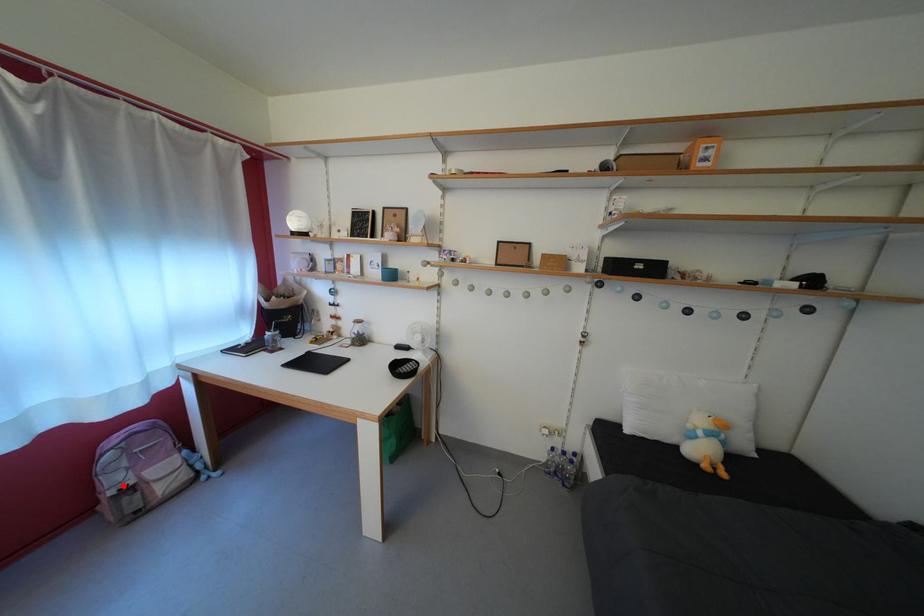
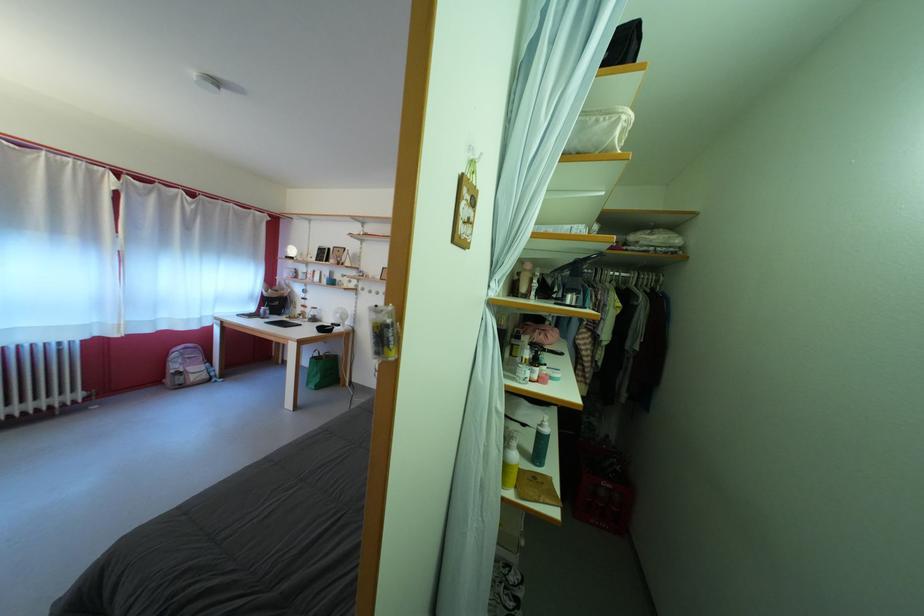
Question: I am providing you with two images of the same scene from different viewpoints. Given a red point in image1, look at the same physical point in image2. Is it:

Choices:
 (A) Closer to the viewpoint
 (B) Farther from the viewpoint

Answer: (A)